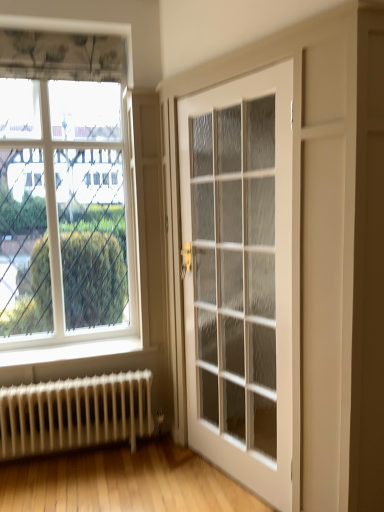
Locate an element on the screen. The height and width of the screenshot is (512, 384). vacant space situated on the left part of white glossy door at center is located at coordinates (162, 481).